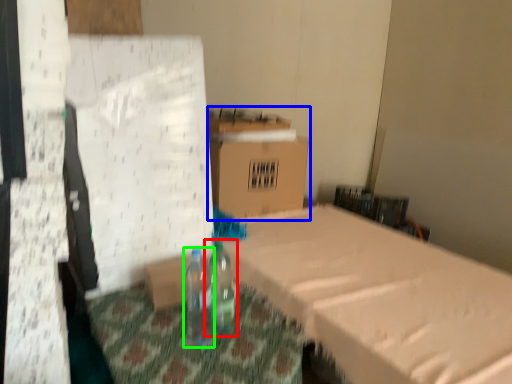
Question: Based on their relative distances, which object is farther from bottle (highlighted by a red box)? Choose from cardboard box (highlighted by a blue box) and bottle (highlighted by a green box).

Choices:
 (A) cardboard box
 (B) bottle

Answer: (A)